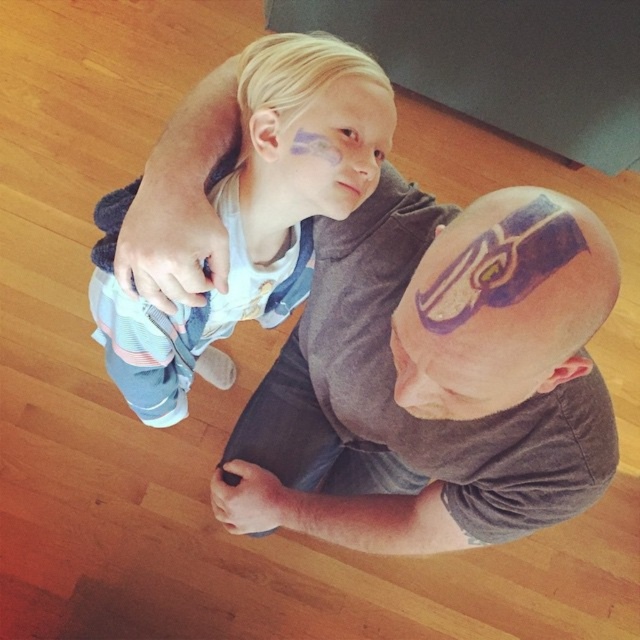
Question: Can you confirm if purple matte bald head at center is thinner than purple matte helmet at center?

Choices:
 (A) yes
 (B) no

Answer: (B)

Question: Can you confirm if purple matte bald head at center is positioned above matte blue paint at upper center?

Choices:
 (A) no
 (B) yes

Answer: (A)

Question: Is purple matte bald head at center wider than matte blue paint at upper center?

Choices:
 (A) no
 (B) yes

Answer: (B)

Question: Which of the following is the farthest from the observer?

Choices:
 (A) (496, 509)
 (B) (168, 374)
 (C) (512, 358)
 (D) (372, 116)

Answer: (B)

Question: Among these objects, which one is nearest to the camera?

Choices:
 (A) purple matte bald head at center
 (B) blonde hair at upper center
 (C) purple matte helmet at center
 (D) matte blue paint at upper center

Answer: (C)

Question: Which object is positioned farthest from the purple matte bald head at center?

Choices:
 (A) purple matte helmet at center
 (B) blonde hair at upper center
 (C) matte blue paint at upper center

Answer: (C)